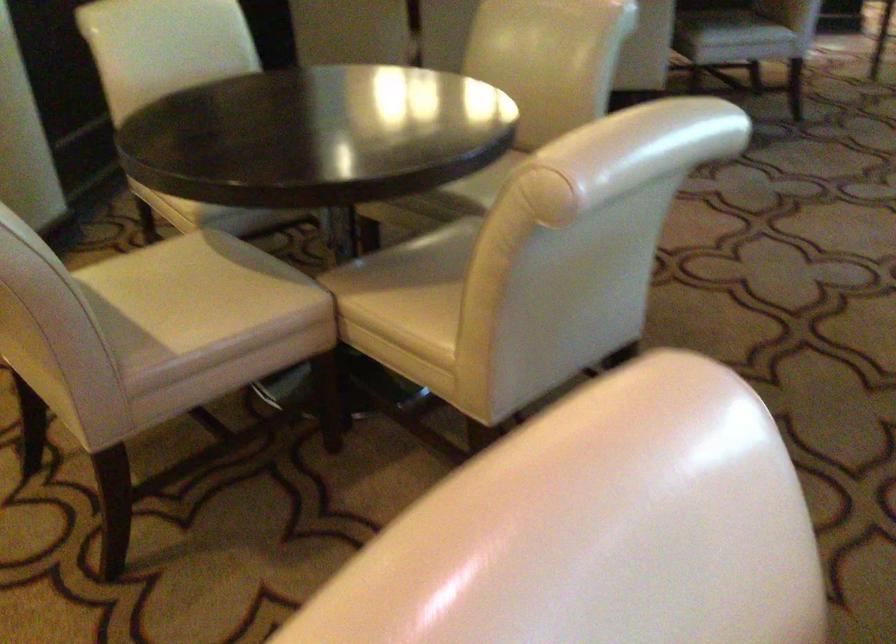
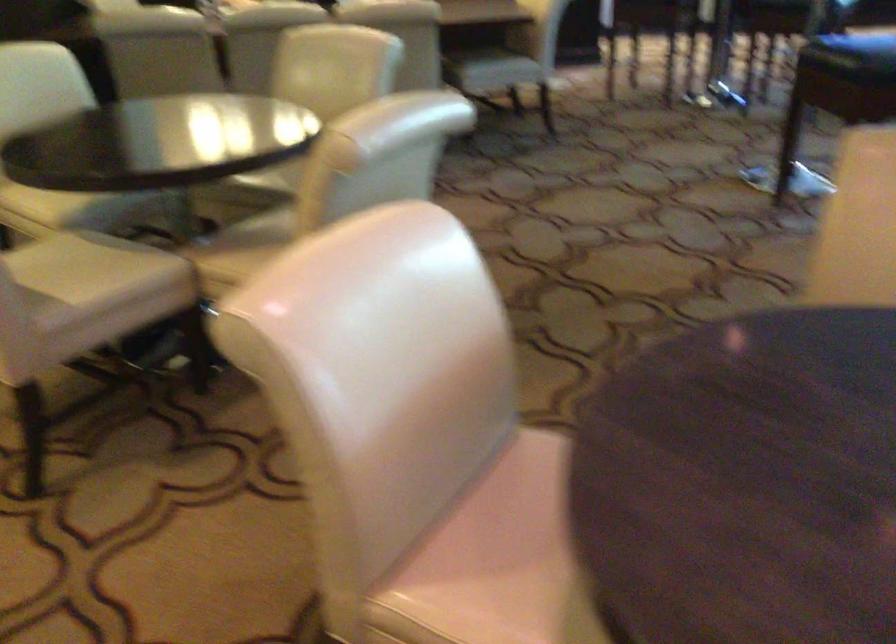
Question: The first image is from the beginning of the video and the second image is from the end. How did the camera likely rotate when shooting the video?

Choices:
 (A) Left
 (B) Right
 (C) Up
 (D) Down

Answer: (B)